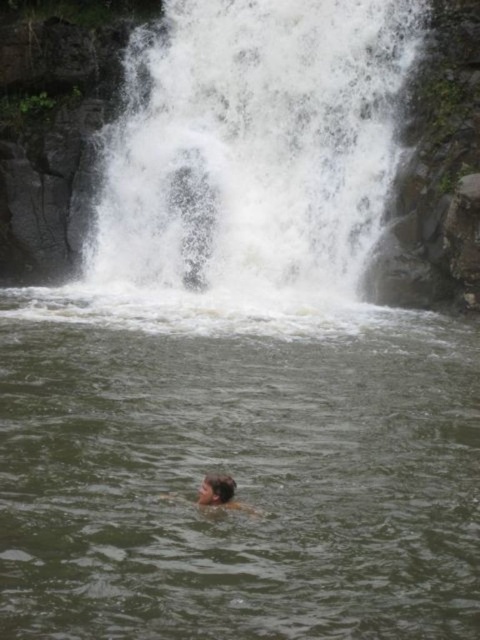
Question: Does white frothy water at upper center lie in front of brown hair at lower center?

Choices:
 (A) yes
 (B) no

Answer: (B)

Question: Which object is positioned closest to the brown hair at lower center?

Choices:
 (A) green liquid water at center
 (B) white frothy water at upper center

Answer: (A)

Question: Estimate the real-world distances between objects in this image. Which object is farther from the white frothy water at upper center?

Choices:
 (A) brown hair at lower center
 (B) green liquid water at center

Answer: (A)

Question: Can you confirm if green liquid water at center is thinner than brown hair at lower center?

Choices:
 (A) no
 (B) yes

Answer: (A)

Question: In this image, where is white frothy water at upper center located relative to brown hair at lower center?

Choices:
 (A) left
 (B) right

Answer: (B)

Question: Which object appears closest to the camera in this image?

Choices:
 (A) green liquid water at center
 (B) white frothy water at upper center
 (C) brown hair at lower center

Answer: (A)